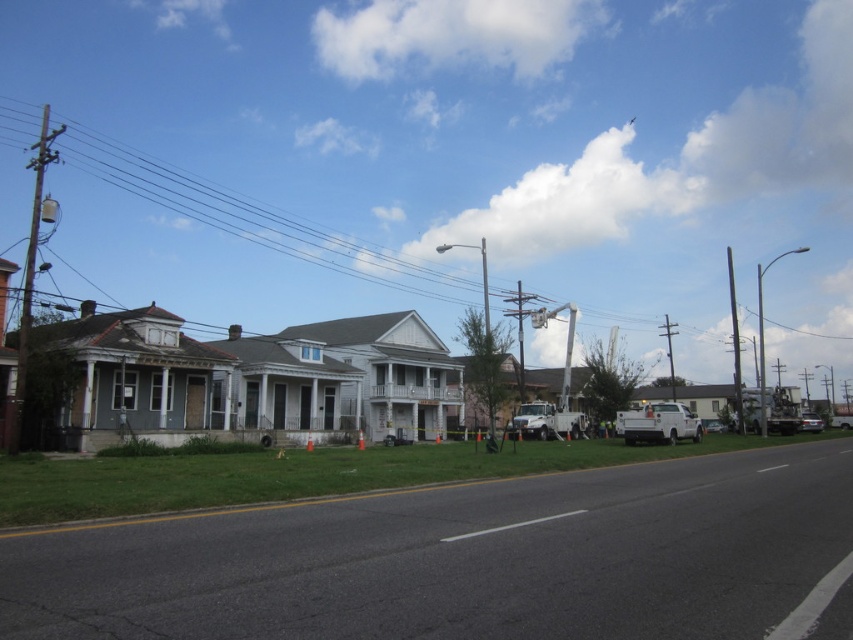
Question: Which point is farther from the camera taking this photo?

Choices:
 (A) (799, 426)
 (B) (641, 426)

Answer: (A)

Question: Does white matte truck at right have a lesser width compared to silver metallic sedan at right?

Choices:
 (A) yes
 (B) no

Answer: (B)

Question: Which point is closer to the camera?

Choices:
 (A) silver metallic sedan at right
 (B) white matte truck at right

Answer: (B)

Question: Is white matte truck at right positioned before silver metallic sedan at right?

Choices:
 (A) yes
 (B) no

Answer: (A)

Question: Does white matte truck at right have a smaller size compared to silver metallic sedan at right?

Choices:
 (A) no
 (B) yes

Answer: (A)